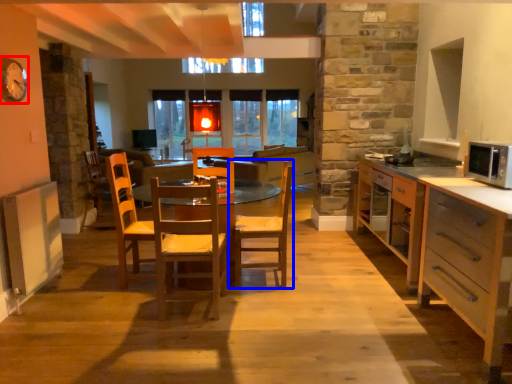
Question: Which of the following is the farthest to the observer, clock (highlighted by a red box) or chair (highlighted by a blue box)?

Choices:
 (A) clock
 (B) chair

Answer: (B)